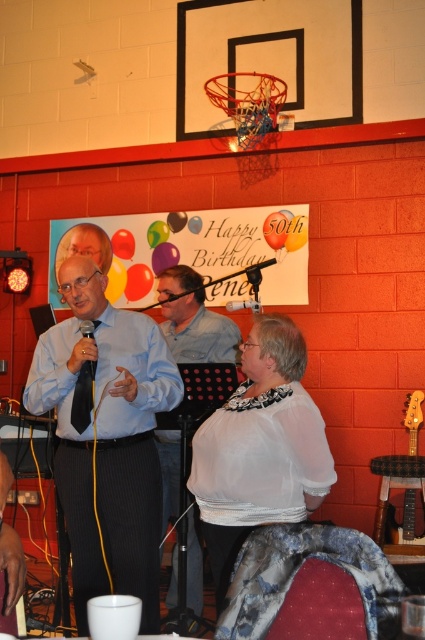
What are the coordinates of the white sheer blouse at center?

The white sheer blouse at center is located at coordinates point (260, 449).

You are a photographer at the birthday party. You need to take a photo of the white sheer blouse at center and the multicolored glossy balloon at upper center. According to the scene description, which object is positioned to the right of the other?

The white sheer blouse at center is to the right of the multicolored glossy balloon at upper center.

You are standing at the point labeled point (x=144, y=268) and want to move to the point labeled point (x=70, y=388). Which direction should you move to reach your destination?

You should move forward to reach point (x=70, y=388) because it is in front of point (x=144, y=268).